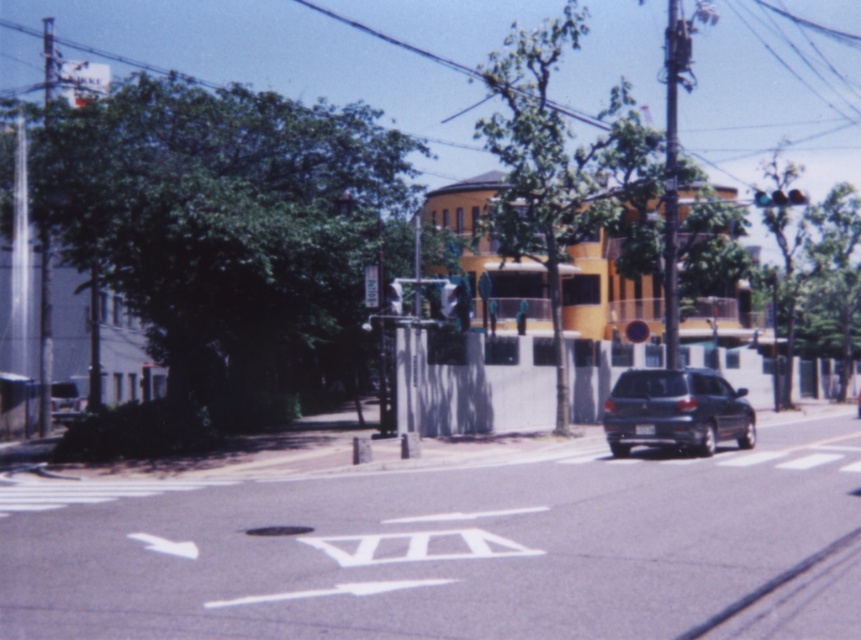
You are a delivery driver who needs to park your vehicle in this area. The matte black suv at center and the metallic reflective street sign at center are present. Based on their sizes, which one would block your view more if parked behind it?

The matte black suv at center is larger than the metallic reflective street sign at center, so it would block your view more if parked behind it.

You are a pedestrian standing on the sidewalk and want to cross the street. You see the matte black suv at center and the metallic reflective street sign at center. Which object is closer to you?

The matte black suv at center is closer to the viewer than the metallic reflective street sign at center.

You are standing at the point closer to the camera in the image. Which point are you at, point (x=785, y=193) or point (x=367, y=282)?

You are at point (x=367, y=282) because it is closer to the camera than point (x=785, y=193).